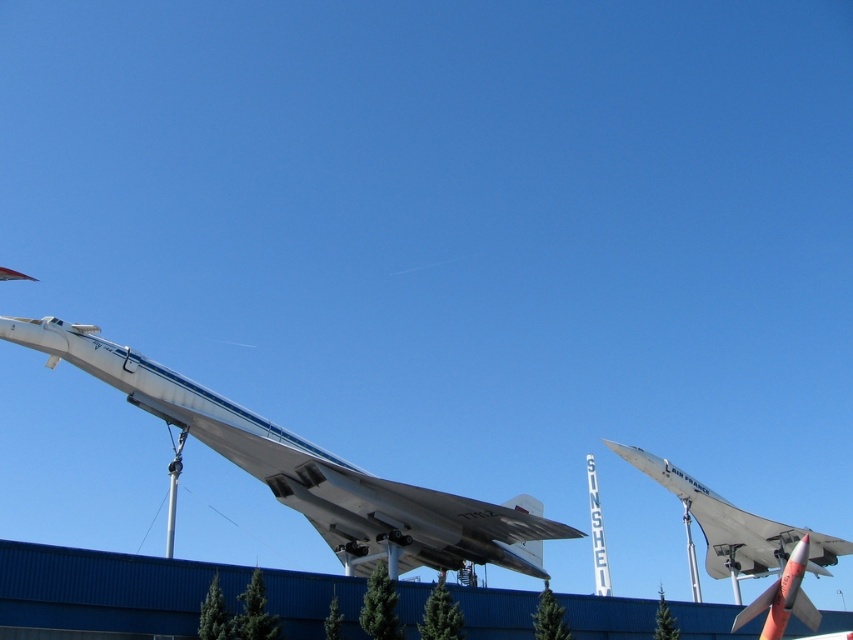
Question: Is white glossy airplane at center above white glossy airplane at right?

Choices:
 (A) yes
 (B) no

Answer: (A)

Question: Is white glossy airplane at center to the left of white glossy airplane at right from the viewer's perspective?

Choices:
 (A) yes
 (B) no

Answer: (A)

Question: Is white glossy airplane at center further to camera compared to white glossy airplane at right?

Choices:
 (A) no
 (B) yes

Answer: (A)

Question: Which point is farther to the camera?

Choices:
 (A) (18, 323)
 (B) (782, 564)

Answer: (B)